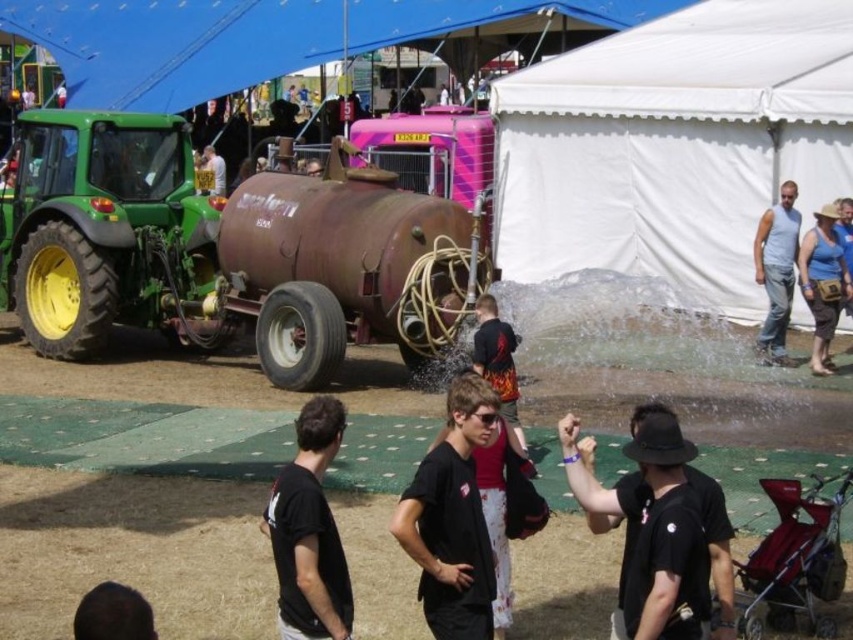
Question: Is black matte shirt at center closer to camera compared to blue fabric hat at upper right?

Choices:
 (A) no
 (B) yes

Answer: (B)

Question: Which object is closer to the camera taking this photo?

Choices:
 (A) black matte hat at lower right
 (B) black matte t-shirt at center
 (C) gray cotton tank top at right
 (D) blue fabric canopy at upper center

Answer: (A)

Question: Does green matte tractor at left appear under blue fabric hat at upper right?

Choices:
 (A) yes
 (B) no

Answer: (B)

Question: Can you confirm if white fabric tent at center is positioned to the left of gray cotton tank top at right?

Choices:
 (A) no
 (B) yes

Answer: (A)

Question: Considering the real-world distances, which object is closest to the blue fabric hat at upper right?

Choices:
 (A) black matte shirt at center
 (B) black matte hat at lower right
 (C) green matte tractor at left
 (D) gray cotton tank top at right

Answer: (D)

Question: Which of the following is the farthest from the observer?

Choices:
 (A) (788, 264)
 (B) (343, 621)
 (C) (86, 108)
 (D) (314, 218)

Answer: (C)